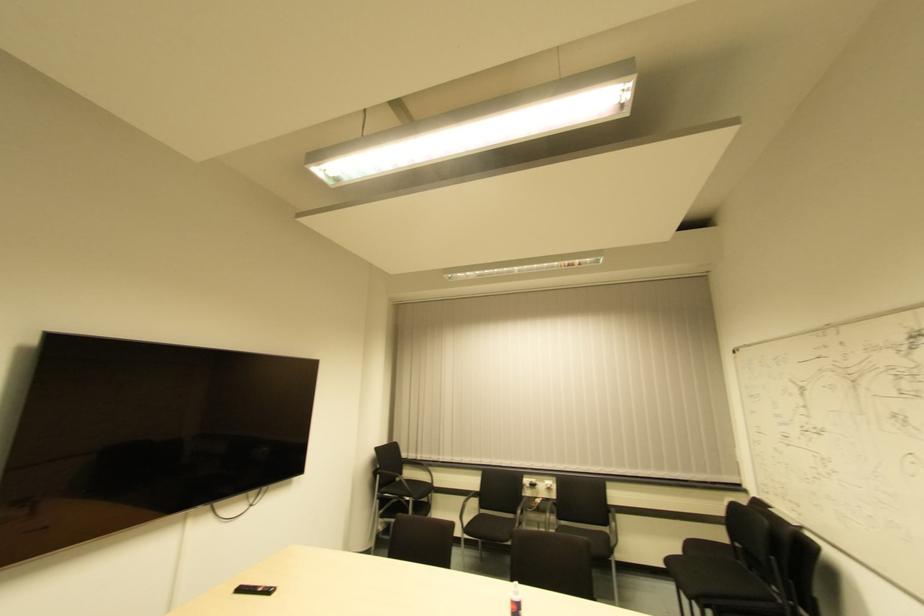
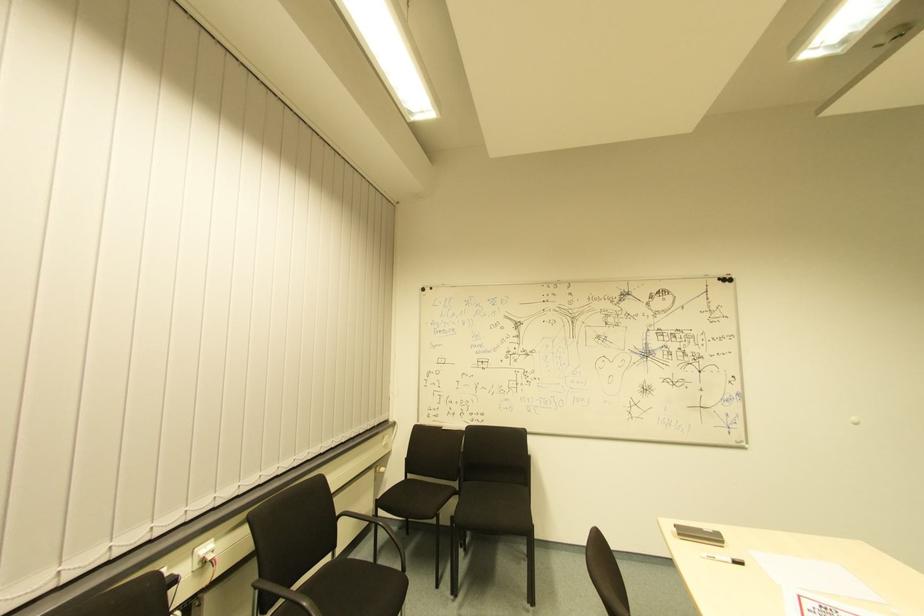
Question: I am providing you with two images of the same scene from different viewpoints. After the viewpoint changes to image2, which objects are now occluded?

Choices:
 (A) black chair sitting surface
 (B) white power socket
 (C) whiteboard magnet
 (D) none of these

Answer: (D)